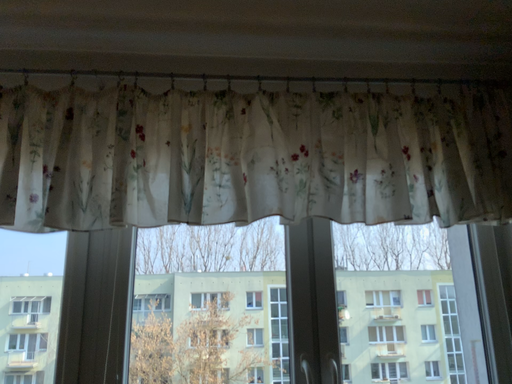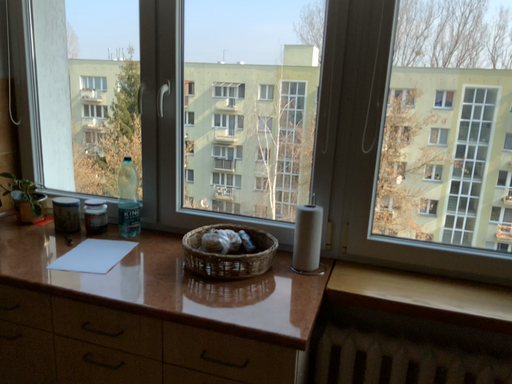
Question: Which way did the camera rotate in the video?

Choices:
 (A) rotated downward
 (B) rotated upward

Answer: (A)